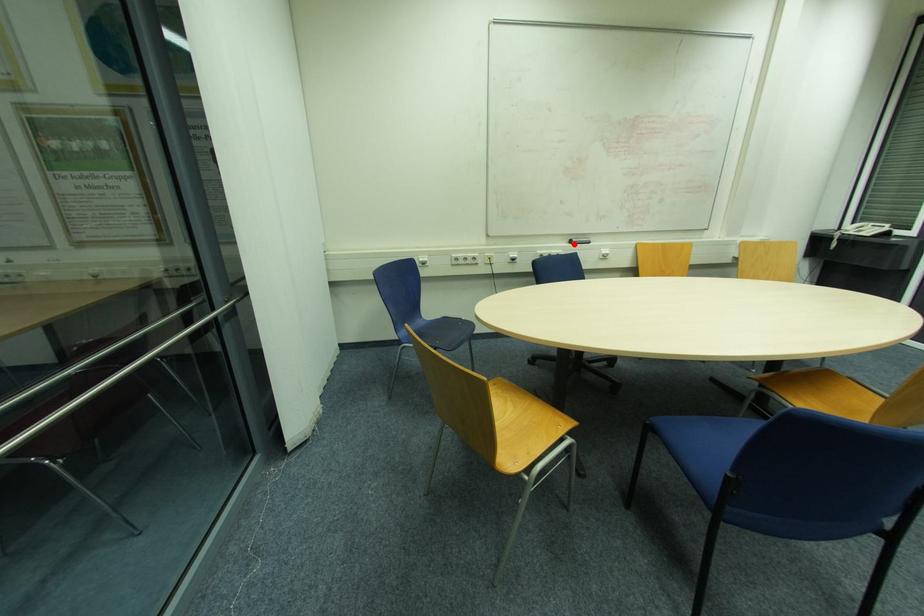
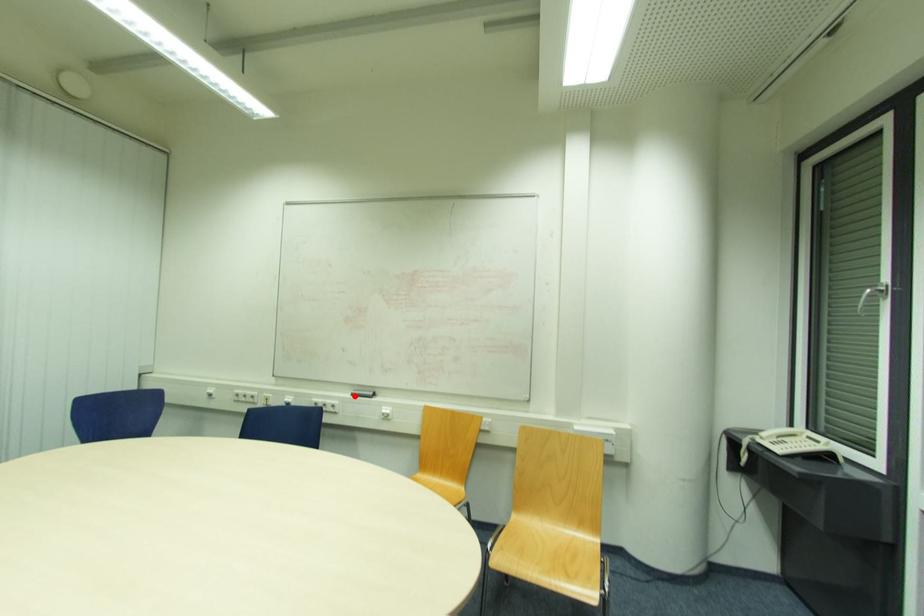
I am providing you with two images of the same scene from different viewpoints. A red point is marked on the first image and another point is marked on the second image. Is the marked point in image1 the same physical position as the marked point in image2?

Yes